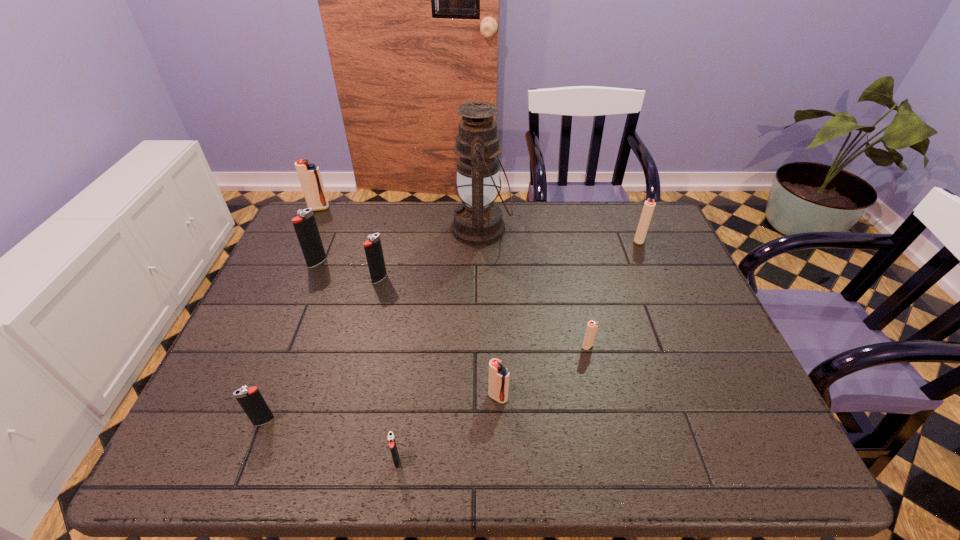
Locate an element on the screen. The height and width of the screenshot is (540, 960). vacant space that's between the third biggest red igniter and the fifth farthest igniter is located at coordinates (542, 372).

Find the location of a particular element. Image resolution: width=960 pixels, height=540 pixels. unoccupied position between the leftmost igniter and the third farthest black igniter is located at coordinates (292, 315).

Where is `free space between the second red igniter from left to right and the second nearest red igniter`? The image size is (960, 540). free space between the second red igniter from left to right and the second nearest red igniter is located at coordinates (542, 372).

Image resolution: width=960 pixels, height=540 pixels. I want to click on empty location between the nearest object and the third nearest black igniter, so click(388, 370).

Image resolution: width=960 pixels, height=540 pixels. I want to click on free space between the second nearest black igniter and the leftmost red igniter, so click(x=292, y=315).

Image resolution: width=960 pixels, height=540 pixels. I want to click on unoccupied area between the second nearest object and the leftmost igniter, so click(x=292, y=315).

Locate an element on the screen. The height and width of the screenshot is (540, 960). vacant point located between the tallest object and the rightmost red igniter is located at coordinates (561, 234).

Select which object is the third closest to the nearest igniter. Please provide its 2D coordinates. Your answer should be formatted as a tuple, i.e. [(x, y)], where the tuple contains the x and y coordinates of a point satisfying the conditions above.

[(592, 326)]

Identify the location of the third closest object relative to the third biggest black igniter. The height and width of the screenshot is (540, 960). pos(498,375).

Point out which igniter is positioned as the second nearest to the second red igniter from right to left. Please provide its 2D coordinates. Your answer should be formatted as a tuple, i.e. [(x, y)], where the tuple contains the x and y coordinates of a point satisfying the conditions above.

[(649, 205)]